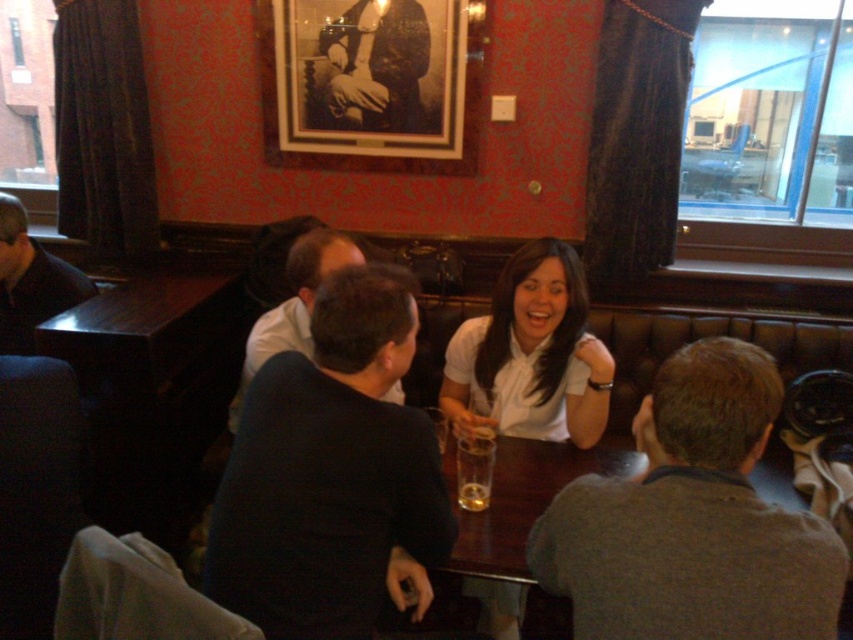
What is located at the point with coordinates (692, 518) in the image?

The point at coordinates (692, 518) corresponds to the gray cotton shirt at upper center.

You are a photographer standing in the pub and want to take a photo of both the point at (422, 124) and the point at (337, 256). Which point is closer to your camera?

Point (337, 256) is closer to the camera than point (422, 124).